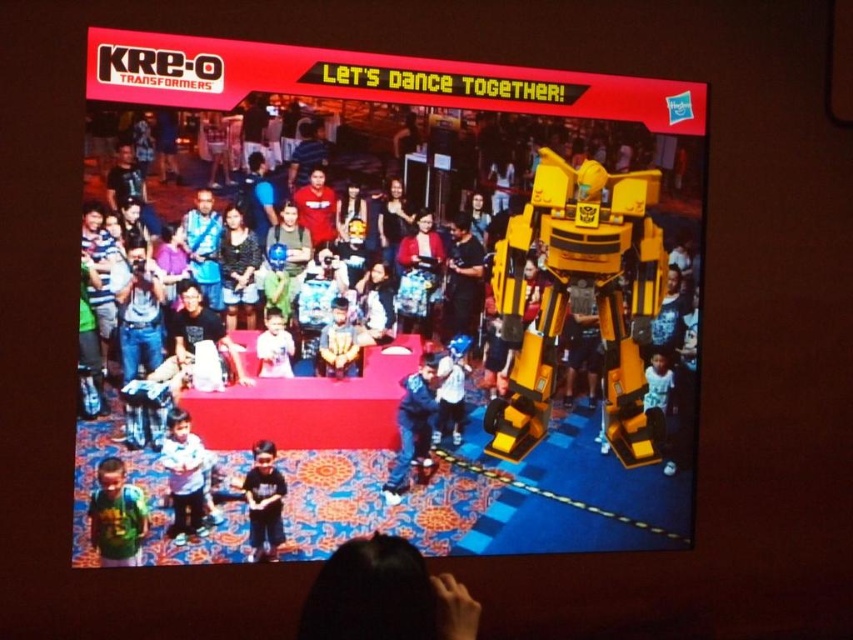
Question: Which object is farther from the camera taking this photo?

Choices:
 (A) dark brown hair at lower center
 (B) light blue shirt at center
 (C) blue jeans at center
 (D) blue fabric cap at center

Answer: (D)

Question: Does light blue shirt at lower left appear on the right side of blue fabric cap at center?

Choices:
 (A) no
 (B) yes

Answer: (A)

Question: Which object is positioned farthest from the blue jeans at center?

Choices:
 (A) matte yellow robot at center
 (B) green jersey at lower left

Answer: (B)

Question: Is green jersey at lower left positioned behind smooth skin face at center?

Choices:
 (A) no
 (B) yes

Answer: (A)

Question: Does light blue shirt at lower left appear on the right side of light blue shirt at center?

Choices:
 (A) yes
 (B) no

Answer: (B)

Question: Estimate the real-world distances between objects in this image. Which object is farther from the smooth skin face at center?

Choices:
 (A) blue jeans at center
 (B) green jersey at lower left
 (C) blue fabric cap at center
 (D) light blue shirt at lower left

Answer: (B)